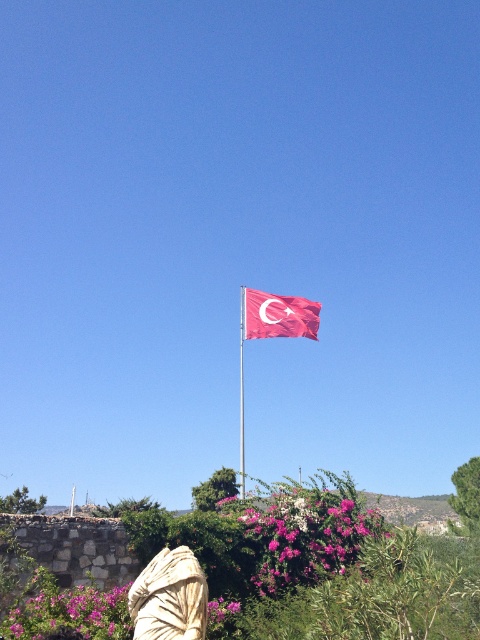
You are a photographer trying to capture the Turkish flag and the pink matte flowers at lower center in a single shot. Based on their positions, where should you position the flowers in the frame relative to the flag?

The pink matte flowers at lower center are located at point (x=295, y=536) in the frame, which means they are positioned to the right and slightly below the center of the image. To include both the flag and the flowers in the shot, you should position the flowers to the right and slightly lower than the flag in the frame.

You are a photographer planning to take a closeup shot of the pink matte flowers at lower center and the beige fabric robe at lower center. Which object should you focus on first if you want to capture both in one frame without moving the camera?

You should focus on the beige fabric robe at lower center first because it is taller than the pink matte flowers at lower center, allowing you to adjust the focus to include both in the frame.

You are a photographer planning to take a photo of the red fabric flag at center and the metallic flag pole at center. You want to ensure both are clearly visible. Based on their positions, which object should you focus on first to capture both in sharp focus?

The metallic flag pole at center is under the red fabric flag at center, so focusing on the metallic flag pole at center first will ensure both are in focus as the flag is above it.